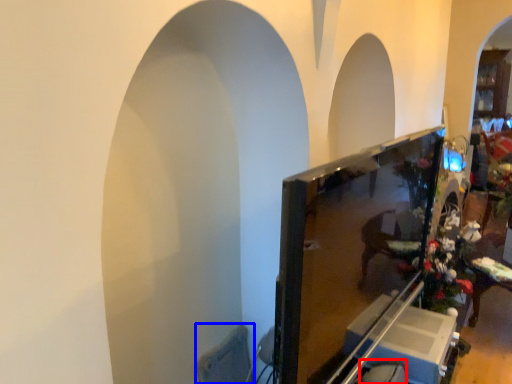
Question: Which object is further to the camera taking this photo, swivel chair (highlighted by a red box) or swivel chair (highlighted by a blue box)?

Choices:
 (A) swivel chair
 (B) swivel chair

Answer: (B)